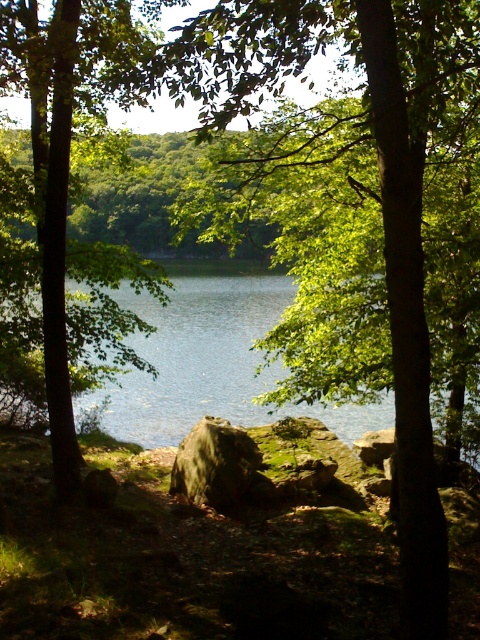
You are a hiker carrying a backpack with a 3.5 meter long rope. You need to cross the water between the green leafy tree at center and the green mossy rock at center. Can you use the rope to make a bridge between them?

The distance between the green leafy tree at center and the green mossy rock at center is 3.61 meters. Since the rope is 3.5 meters long, it is slightly shorter than the required distance, so the rope would not be long enough to span the gap between them.

You are standing in the forest looking at the scene. Which object is higher up in the view between the green leafy tree at left and the green water at center?

The green leafy tree at left is located above the green water at center, so it is higher up in the view.